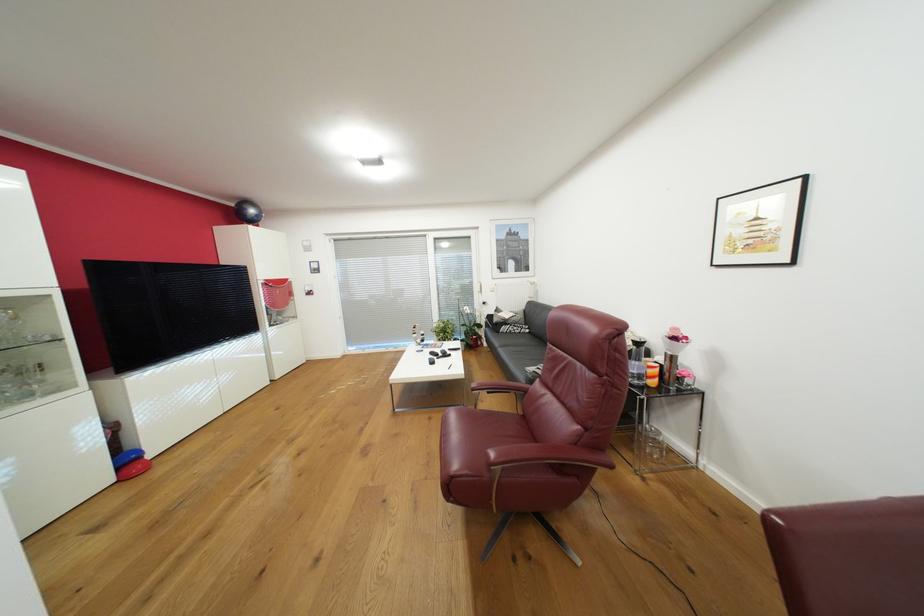
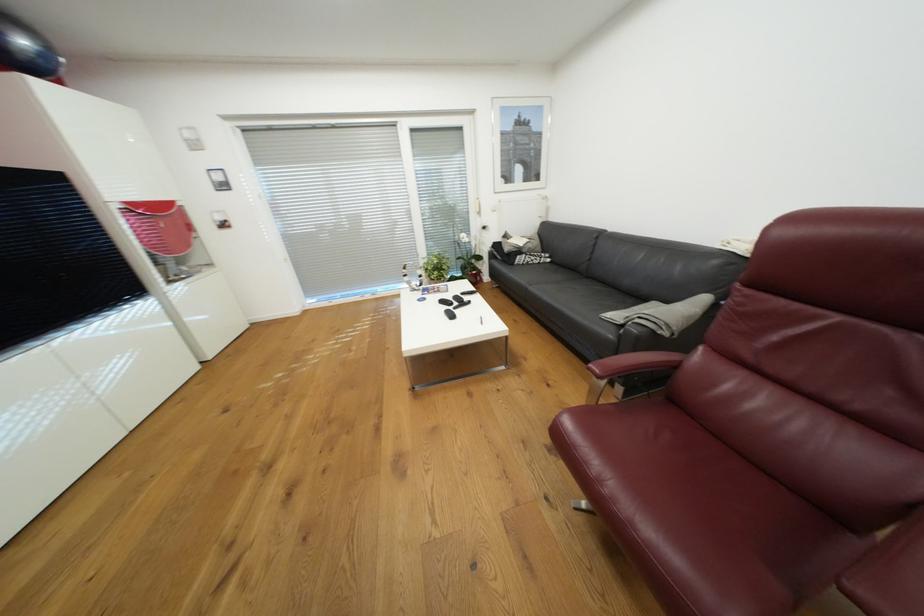
Find the pixel in the second image that matches point 259,211 in the first image.

(29, 42)